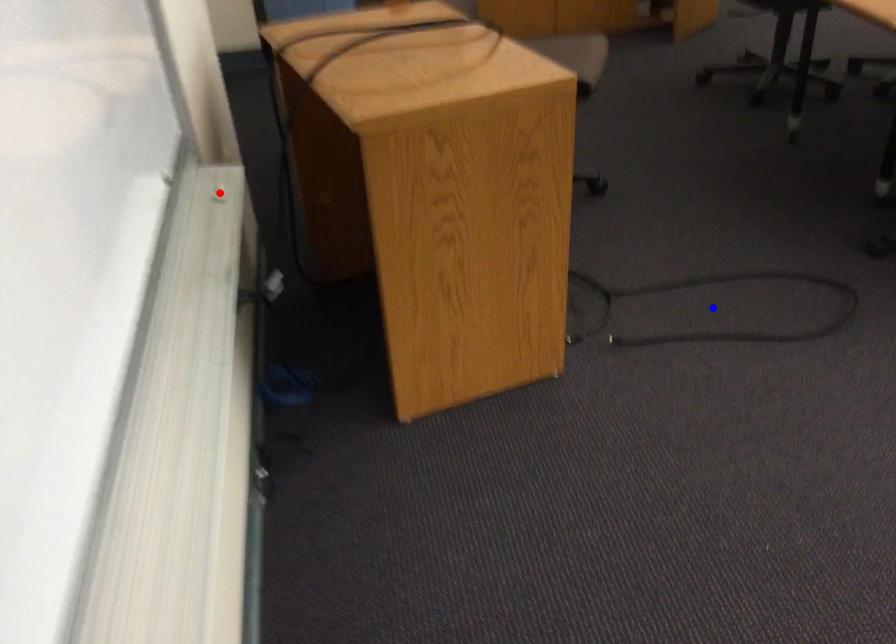
Question: Which of the two points in the image is closer to the camera?

Choices:
 (A) Blue point is closer.
 (B) Red point is closer.

Answer: (B)